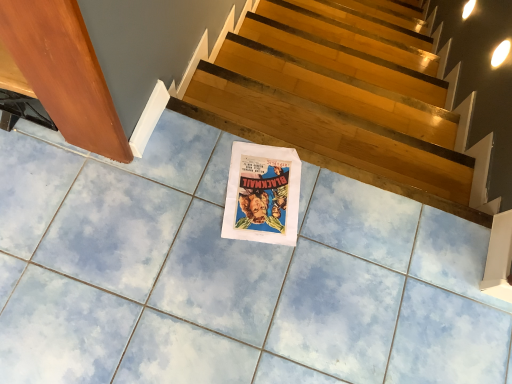
Where is `vacant space that is to the left of white paper at center`? The image size is (512, 384). vacant space that is to the left of white paper at center is located at coordinates (187, 178).